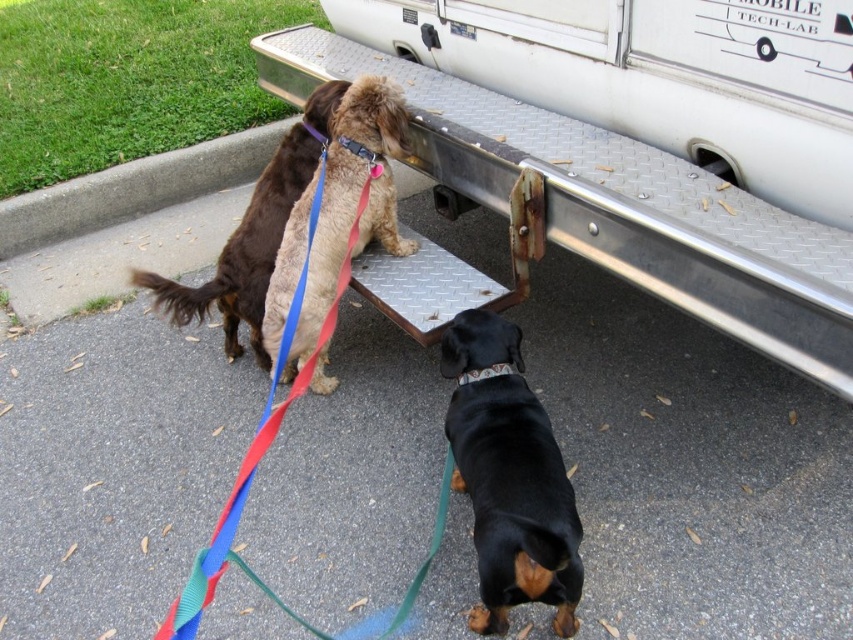
Who is more forward, (282, 220) or (479, 376)?

Point (479, 376)

Which is below, brown fuzzy dog at upper left or black fabric neckband at center?

Positioned lower is black fabric neckband at center.

Does point (312, 93) lie in front of point (509, 372)?

That is False.

Find the location of a particular element. brown fuzzy dog at upper left is located at coordinates (253, 236).

Is fuzzy brown dog at center to the left of black fabric neckband at center from the viewer's perspective?

Yes, fuzzy brown dog at center is to the left of black fabric neckband at center.

Can you confirm if fuzzy brown dog at center is positioned above black fabric neckband at center?

Yes, fuzzy brown dog at center is above black fabric neckband at center.

I want to click on fuzzy brown dog at center, so click(352, 200).

Locate an element on the screen. This screenshot has height=640, width=853. fuzzy brown dog at center is located at coordinates (352, 200).

Find the location of `black smooth dog at lower center`. black smooth dog at lower center is located at coordinates (509, 480).

Can you confirm if black smooth dog at lower center is positioned to the left of black fabric neckband at center?

No, black smooth dog at lower center is not to the left of black fabric neckband at center.

At what (x,y) coordinates should I click in order to perform the action: click on black smooth dog at lower center. Please return your answer as a coordinate pair (x, y). Image resolution: width=853 pixels, height=640 pixels. Looking at the image, I should click on (509, 480).